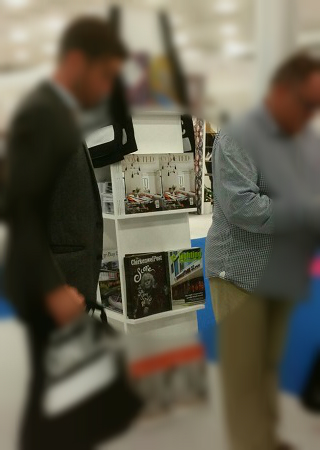
You are a GUI agent. You are given a task and a screenshot of the screen. Output one action in this format:
    pyautogui.click(x=<x>, y=<y>)
    Task: Click on the two of the same books side by side
    This screenshot has height=450, width=320.
    Given the screenshot: What is the action you would take?
    pyautogui.click(x=152, y=189), pyautogui.click(x=183, y=196)